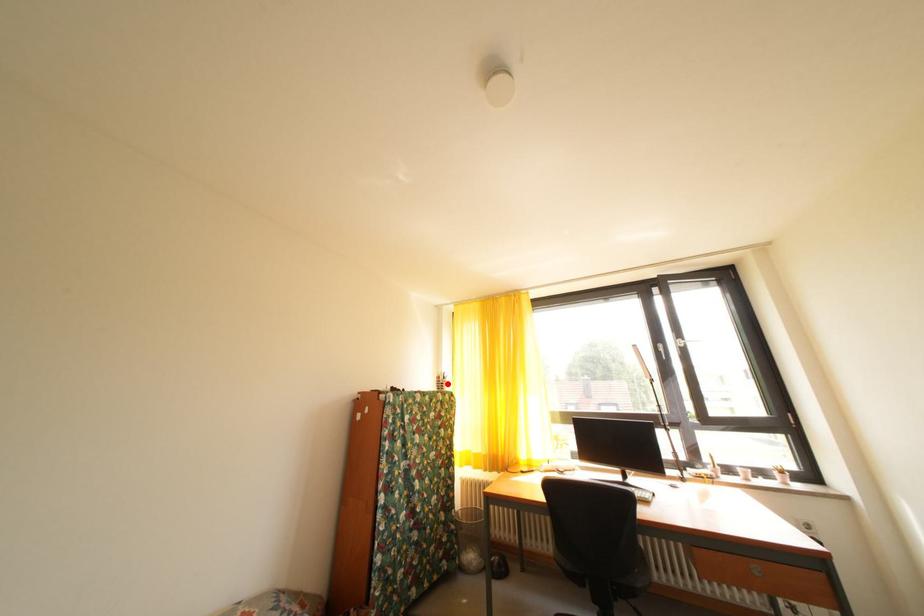
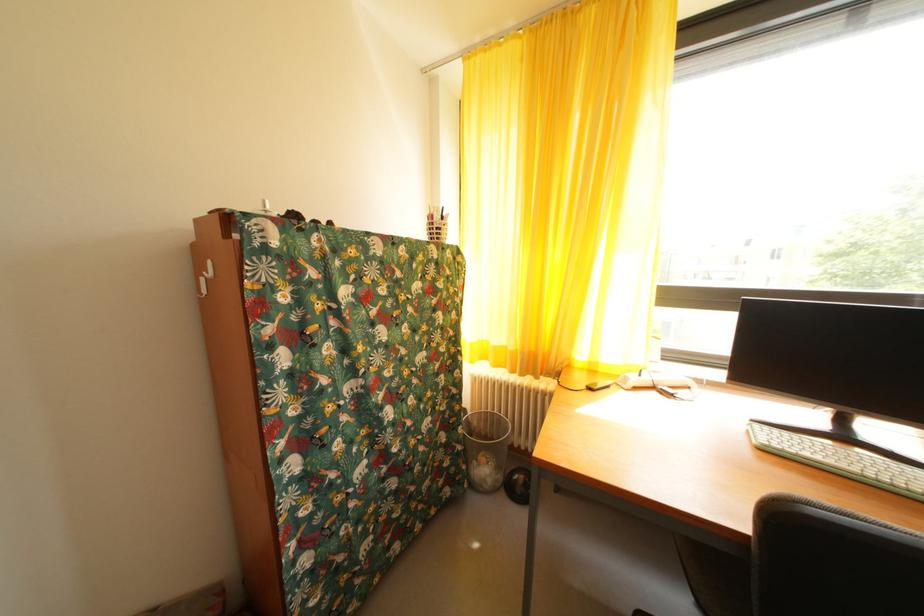
Locate, in the second image, the point that corresponds to the highlighted location in the first image.

(440, 223)